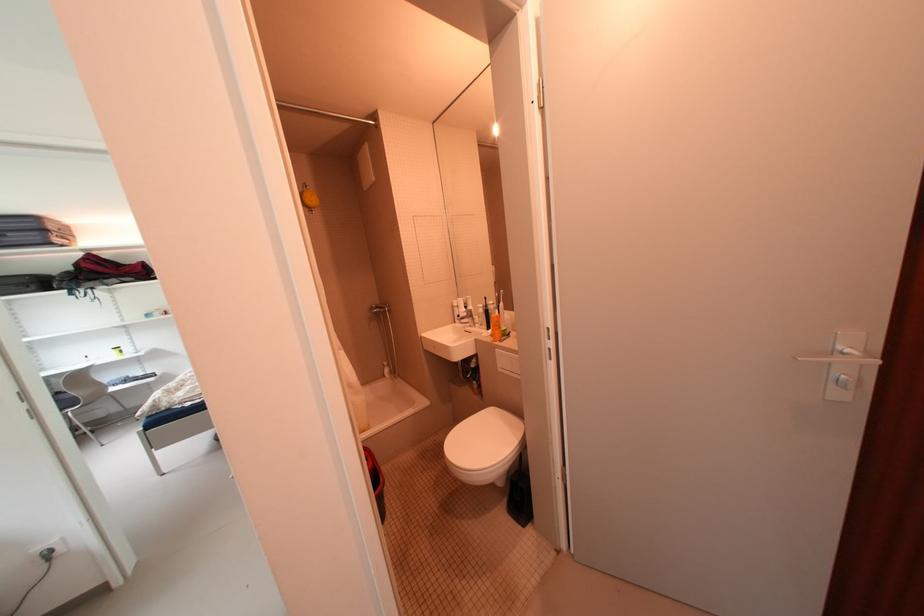
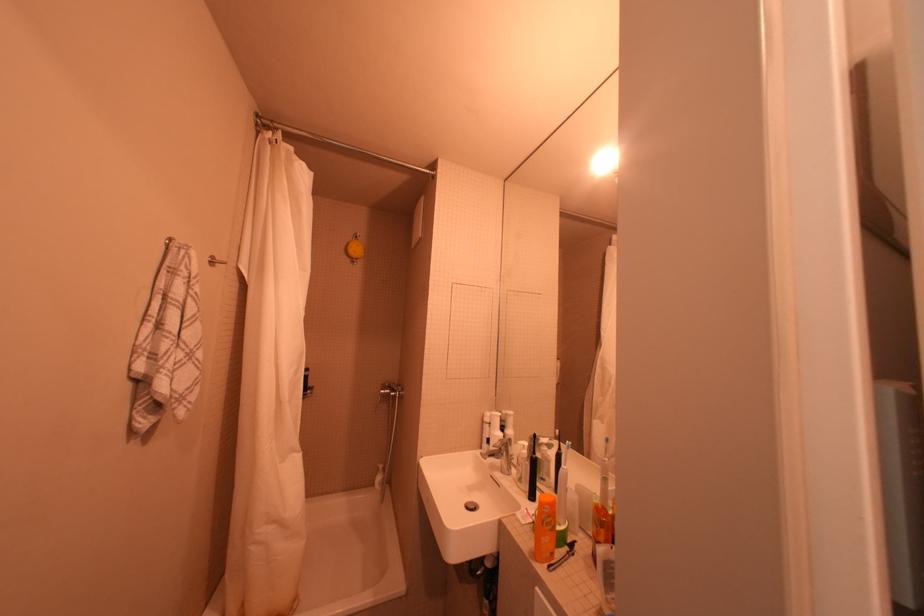
Where in the second image is the point corresponding to (390,309) from the first image?

(402, 391)